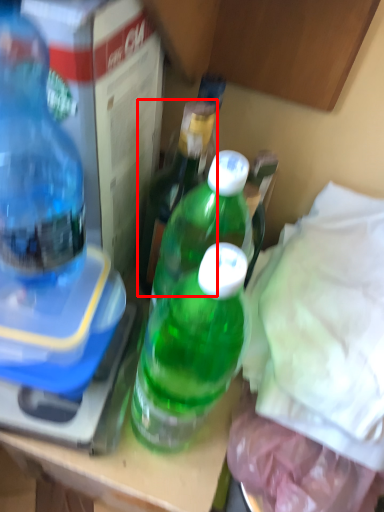
Question: From the image, what is the correct spatial relationship of bottle (annotated by the red box) in relation to bottle?

Choices:
 (A) right
 (B) left

Answer: (A)